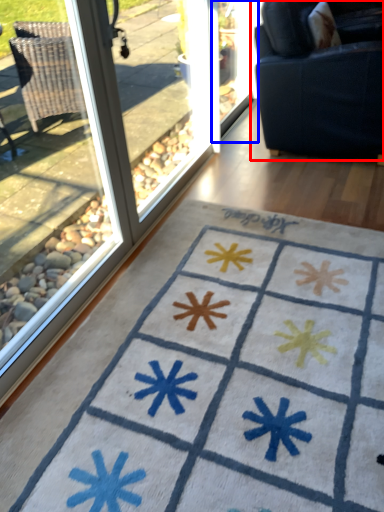
Question: Which point is further to the camera, studio couch (highlighted by a red box) or screen door (highlighted by a blue box)?

Choices:
 (A) studio couch
 (B) screen door

Answer: (B)